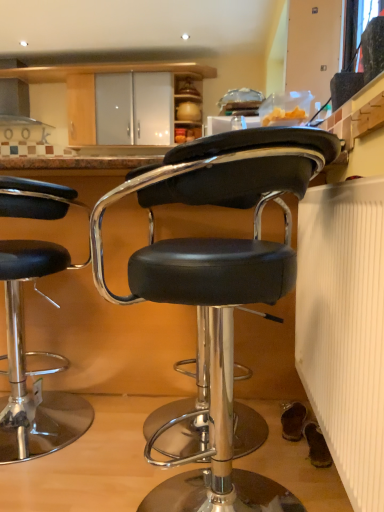
Question: In terms of height, does black leather stool at center, the 1th chair from the front, look taller or shorter compared to white ribbed radiator at lower right?

Choices:
 (A) short
 (B) tall

Answer: (B)

Question: In terms of width, does black leather stool at center, placed as the 2th chair when sorted from back to front, look wider or thinner when compared to white ribbed radiator at lower right?

Choices:
 (A) thin
 (B) wide

Answer: (B)

Question: Which object is positioned closest to the black leather stool at left, which appears as the 1th chair when viewed from the back?

Choices:
 (A) black leather stool at center, the 1th chair from the front
 (B) transparent glass window screen at upper right
 (C) white ribbed radiator at lower right

Answer: (A)

Question: Which object is the closest to the black leather stool at center, the 1th chair from the front?

Choices:
 (A) transparent glass window screen at upper right
 (B) white ribbed radiator at lower right
 (C) black leather stool at left, which ranks as the second chair in right-to-left order

Answer: (B)